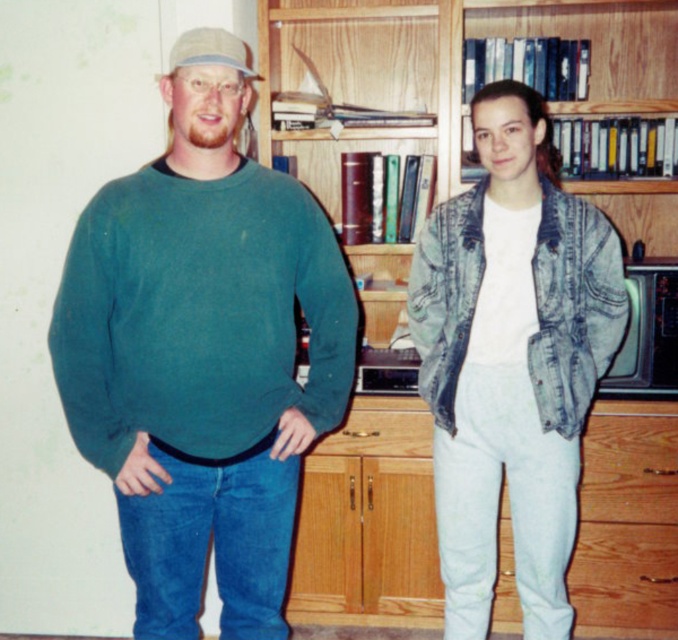
From the picture: You are a delivery person who needs to place a package between the two people in the scene. The package is 3 feet long. Will there be enough space between the teal matte sweater at left and the other person to place the package?

The two people are 4.70 feet apart, so yes, there is enough space to place the 3 feet long package between the teal matte sweater at left and the other person.

You are a delivery person who needs to place a package between the denim jacket at center and the wooden bookcase at center. The package is 30 inches long. Can you fit it between them without moving either object?

The denim jacket at center is 31.16 inches away from the wooden bookcase at center, so the 30 inches long package can fit between them since the distance is slightly larger than the package length.

You are standing in a study with two people. The man is wearing a green long sleeved shirt, and the woman is wearing a white t shirt under a denim jacket. There is a point marked at coordinates (x=201, y=353). What object or clothing item is located at that point?

The teal matte sweater at left is located at the point marked by coordinates (x=201, y=353).